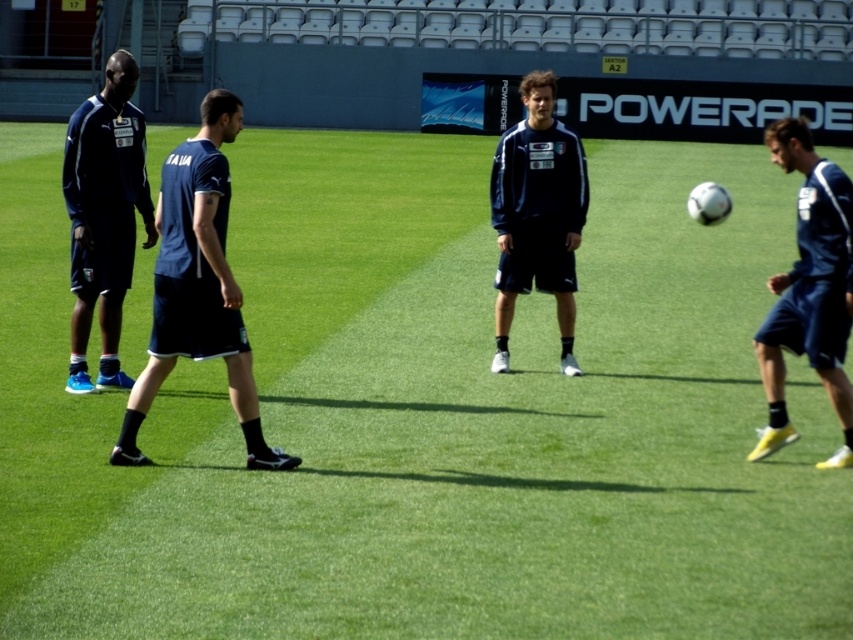
Question: Does dark blue shorts at right have a smaller size compared to dark blue jersey at center?

Choices:
 (A) no
 (B) yes

Answer: (A)

Question: Based on their relative distances, which object is farther from the dark blue fabric shorts at center?

Choices:
 (A) dark blue shorts at right
 (B) dark blue jersey at center
 (C) matte blue shorts at left

Answer: (A)

Question: Which point is farther to the camera?

Choices:
 (A) dark blue jersey at center
 (B) matte blue shorts at left
 (C) dark blue fabric shorts at center
 (D) dark blue shorts at right

Answer: (A)

Question: Does dark blue fabric shorts at center have a greater width compared to dark blue jersey at center?

Choices:
 (A) yes
 (B) no

Answer: (A)

Question: Is matte blue shorts at left wider than dark blue shorts at right?

Choices:
 (A) yes
 (B) no

Answer: (A)

Question: Which object appears closest to the camera in this image?

Choices:
 (A) dark blue fabric shorts at center
 (B) matte blue shorts at left
 (C) dark blue shorts at right

Answer: (A)